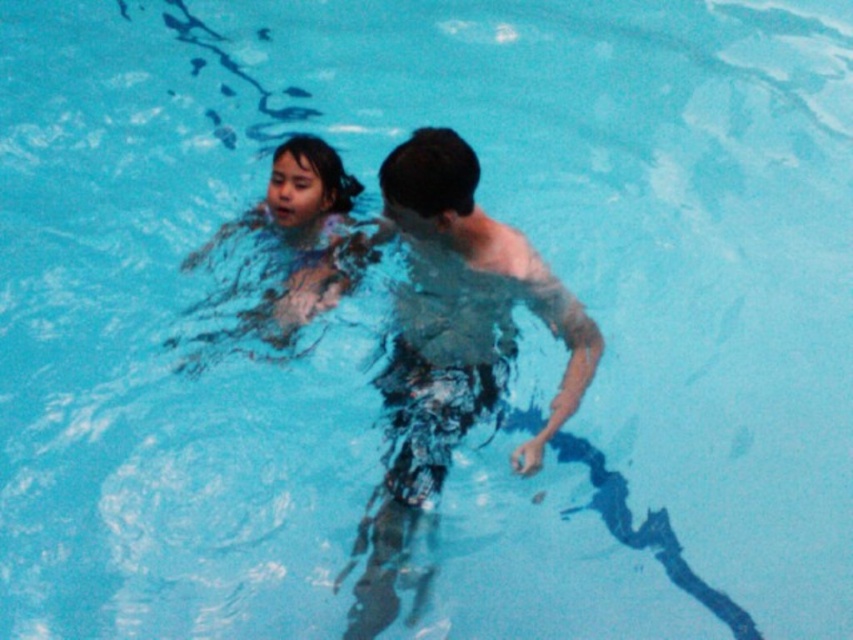
Consider the image. You are a photographer taking a picture of the smooth skin child at center and the translucent wet hair at upper center. To ensure both are in focus, you need to adjust your camera settings. Which object should you focus on first to capture both clearly?

The translucent wet hair at upper center is located below the smooth skin child at center. Since the child is closer to the camera, focusing on the smooth skin child at center first will ensure both are in focus as the hair is behind them.

You are a photographer trying to capture the translucent wet hair at upper center in the image. The camera is positioned to focus on the point at coordinates point (451, 344). Can you confirm if this point is correctly aligned with the translucent wet hair at upper center?

Yes, the point (451, 344) corresponds to the translucent wet hair at upper center, so the camera is correctly aligned with the translucent wet hair at upper center.